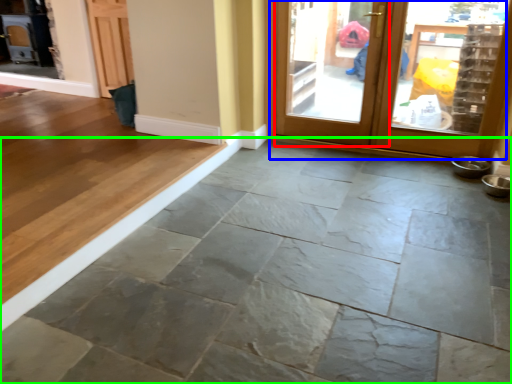
Question: Which object is positioned closest to screen door (highlighted by a red box)? Select from door (highlighted by a blue box) and concrete (highlighted by a green box).

Choices:
 (A) door
 (B) concrete

Answer: (A)